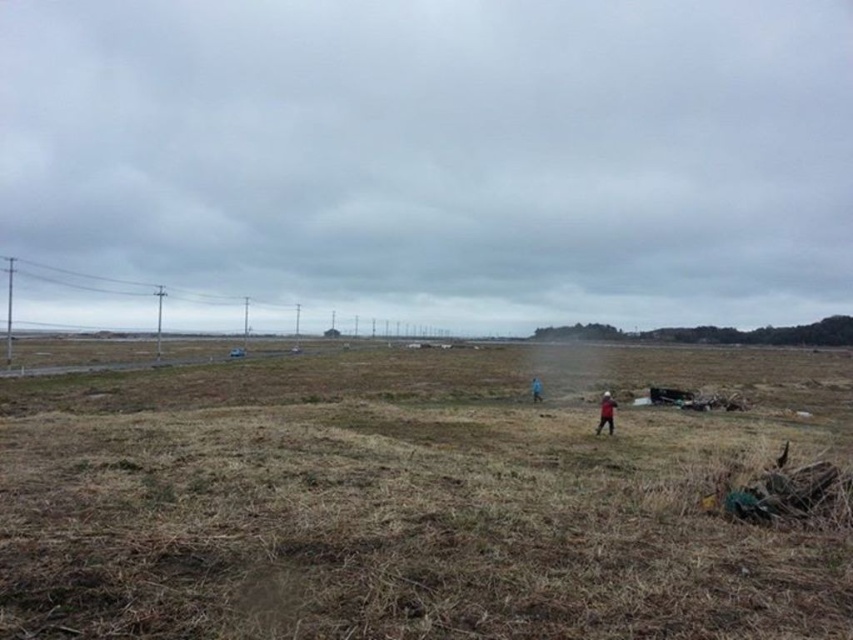
You are standing at the point labeled as point (410, 499) in the image. Based on the scene description, what is the immediate terrain you are standing on?

The immediate terrain you are standing on at point (410, 499) is the brown grassy field at center.